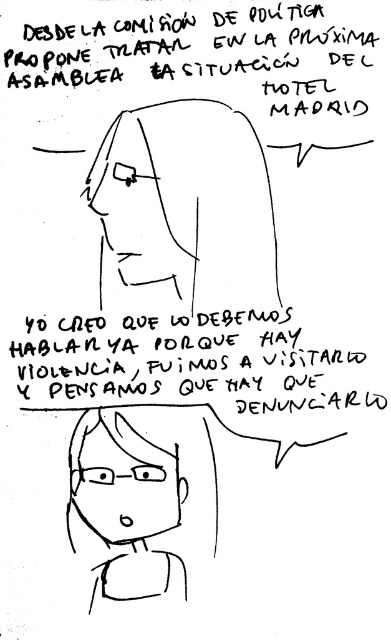
Question: Based on their relative distances, which object is nearer to the matte black hair at upper center?

Choices:
 (A) black handwritten text at center
 (B) black paper text at upper center

Answer: (A)

Question: Is black paper text at upper center wider than black handwritten text at center?

Choices:
 (A) yes
 (B) no

Answer: (B)

Question: Does matte black hair at upper center appear on the right side of black handwritten text at center?

Choices:
 (A) yes
 (B) no

Answer: (B)

Question: Which object is closer to the camera taking this photo?

Choices:
 (A) matte black hair at upper center
 (B) black handwritten text at center

Answer: (A)

Question: Which point is closer to the camera?

Choices:
 (A) matte black hair at upper center
 (B) black paper text at upper center
 (C) black handwritten text at center

Answer: (B)

Question: Can you confirm if matte black hair at upper center is positioned above black paper text at upper center?

Choices:
 (A) yes
 (B) no

Answer: (B)